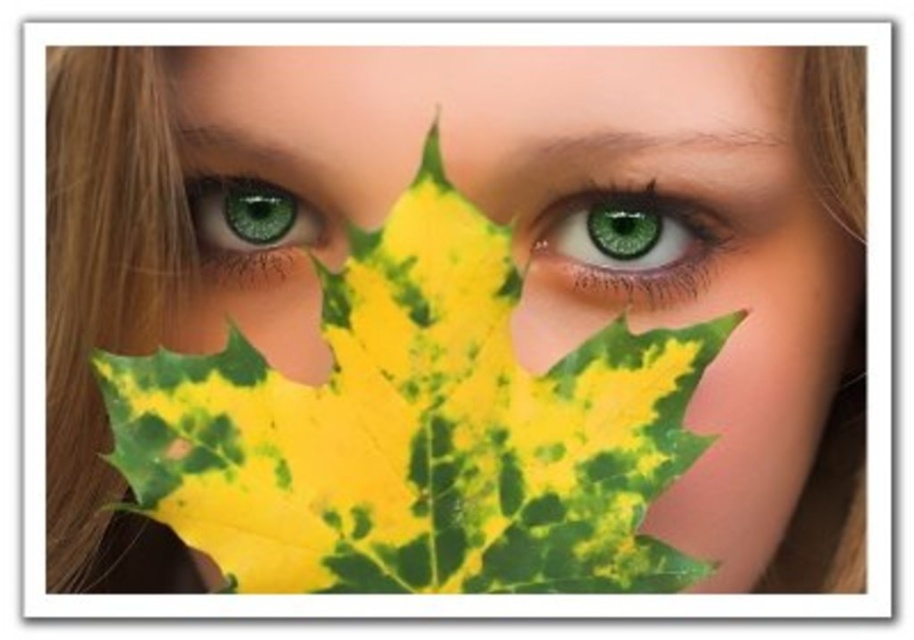
Question: Which point is closer to the camera?

Choices:
 (A) (259, 193)
 (B) (574, 269)

Answer: (B)

Question: Does green matte eye at center have a larger size compared to green matte eye at upper left?

Choices:
 (A) no
 (B) yes

Answer: (B)

Question: Which point is closer to the camera taking this photo?

Choices:
 (A) (550, 244)
 (B) (311, 218)

Answer: (A)

Question: Is green matte eye at center to the right of green matte eye at upper left from the viewer's perspective?

Choices:
 (A) no
 (B) yes

Answer: (B)

Question: Among these objects, which one is nearest to the camera?

Choices:
 (A) green matte eye at upper left
 (B) green matte eye at center

Answer: (B)

Question: Can you confirm if green matte eye at center is wider than green matte eye at upper left?

Choices:
 (A) yes
 (B) no

Answer: (A)